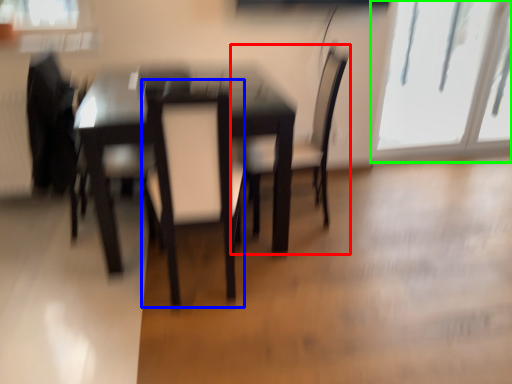
Question: Based on their relative distances, which object is farther from chair (highlighted by a red box)? Choose from swivel chair (highlighted by a blue box) and window (highlighted by a green box).

Choices:
 (A) swivel chair
 (B) window

Answer: (B)